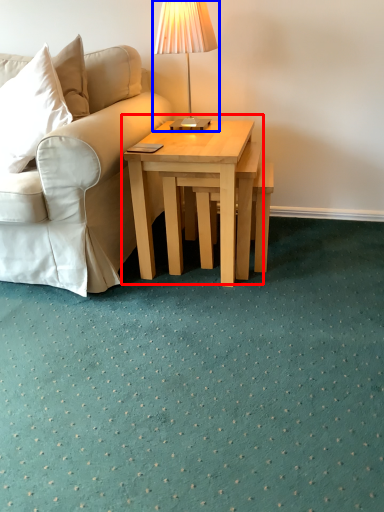
Question: Which point is further to the camera, coffee table (highlighted by a red box) or table lamp (highlighted by a blue box)?

Choices:
 (A) coffee table
 (B) table lamp

Answer: (B)